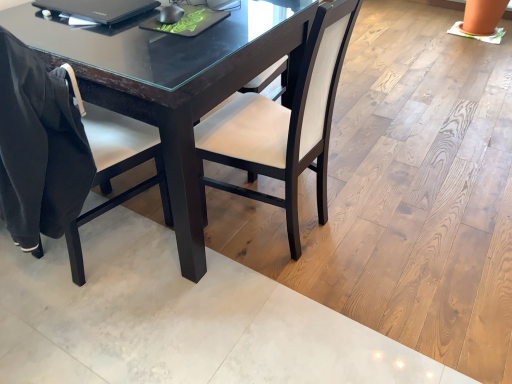
What do you see at coordinates (285, 123) in the screenshot?
I see `satin white chair at center, the 2th chair viewed from the left` at bounding box center [285, 123].

Locate an element on the screen. black matte chair at left, the 2th chair in the right-to-left sequence is located at coordinates (61, 153).

What's the angular difference between satin white chair at center, which is the first chair from right to left, and black matte chair at left, the 2th chair in the right-to-left sequence,'s facing directions?

There is a 88.6-degree angle between the facing directions of satin white chair at center, which is the first chair from right to left, and black matte chair at left, the 2th chair in the right-to-left sequence.

Considering the positions of objects satin white chair at center, the 2th chair viewed from the left, and black matte chair at left, placed as the first chair when sorted from left to right, in the image provided, who is more to the right, satin white chair at center, the 2th chair viewed from the left, or black matte chair at left, placed as the first chair when sorted from left to right,?

satin white chair at center, the 2th chair viewed from the left, is more to the right.

Would you say satin white chair at center, which is the first chair from right to left, is a long distance from black matte chair at left, placed as the first chair when sorted from left to right?

They are positioned close to each other.

Looking at this image, from the image's perspective, which object appears higher, satin white chair at center, the 2th chair viewed from the left, or black matte chair at left, the 2th chair in the right-to-left sequence?

satin white chair at center, the 2th chair viewed from the left.

Is there a large distance between black matte chair at left, the 2th chair in the right-to-left sequence, and satin white chair at center, which is the first chair from right to left?

No, black matte chair at left, the 2th chair in the right-to-left sequence, is in close proximity to satin white chair at center, which is the first chair from right to left.

What are the coordinates of `chair that is in front of the satin white chair at center, the 2th chair viewed from the left` in the screenshot? It's located at (x=61, y=153).

In the image, is black matte chair at left, the 2th chair in the right-to-left sequence, positioned in front of or behind satin white chair at center, which is the first chair from right to left?

Visually, black matte chair at left, the 2th chair in the right-to-left sequence, is located in front of satin white chair at center, which is the first chair from right to left.

Which of these two, black matte chair at left, placed as the first chair when sorted from left to right, or satin white chair at center, which is the first chair from right to left, is wider?

Wider between the two is black matte chair at left, placed as the first chair when sorted from left to right.

Is point (84, 16) positioned in front of point (42, 170)?

That is False.

Does black glossy laptop at upper left come in front of black matte chair at left, the 2th chair in the right-to-left sequence?

No.

In the scene shown: Considering the relative sizes of black glossy laptop at upper left and black matte chair at left, the 2th chair in the right-to-left sequence, in the image provided, is black glossy laptop at upper left smaller than black matte chair at left, the 2th chair in the right-to-left sequence,?

Yes.

Which of these two, satin white chair at center, the 2th chair viewed from the left, or black glossy laptop at upper left, is smaller?

Smaller between the two is black glossy laptop at upper left.

From the image's perspective, is satin white chair at center, which is the first chair from right to left, located beneath black glossy laptop at upper left?

Yes, from the image's perspective, satin white chair at center, which is the first chair from right to left, is below black glossy laptop at upper left.

Is point (272, 108) in front of point (88, 0)?

No, it is behind (88, 0).

From the image's perspective, which is above, black glossy laptop at upper left or satin white chair at center, the 2th chair viewed from the left?

black glossy laptop at upper left is shown above in the image.

Is black glossy laptop at upper left smaller than satin white chair at center, which is the first chair from right to left?

Indeed, black glossy laptop at upper left has a smaller size compared to satin white chair at center, which is the first chair from right to left.

Is the position of black glossy laptop at upper left more distant than that of satin white chair at center, the 2th chair viewed from the left?

Yes, black glossy laptop at upper left is further from the camera.

Which is nearer, (54, 4) or (213, 144)?

The point (54, 4) is closer.

Is black matte chair at left, the 2th chair in the right-to-left sequence, shorter than black glossy laptop at upper left?

In fact, black matte chair at left, the 2th chair in the right-to-left sequence, may be taller than black glossy laptop at upper left.

Consider the image. Which is correct: black matte chair at left, the 2th chair in the right-to-left sequence, is inside black glossy laptop at upper left, or outside of it?

black matte chair at left, the 2th chair in the right-to-left sequence, is not inside black glossy laptop at upper left, it's outside.

Which chair is the 2nd one when counting from the front of the black glossy laptop at upper left? Please provide its 2D coordinates.

[(61, 153)]

Where is `chair lying on the right of black matte chair at left, the 2th chair in the right-to-left sequence`? chair lying on the right of black matte chair at left, the 2th chair in the right-to-left sequence is located at coordinates (285, 123).

The height and width of the screenshot is (384, 512). What are the coordinates of `chair above the satin white chair at center, which is the first chair from right to left (from a real-world perspective)` in the screenshot? It's located at (61, 153).

From the image, which object appears to be farther from black matte chair at left, the 2th chair in the right-to-left sequence, black glossy laptop at upper left or satin white chair at center, the 2th chair viewed from the left?

black glossy laptop at upper left is further to black matte chair at left, the 2th chair in the right-to-left sequence.

Considering their positions, is black matte chair at left, the 2th chair in the right-to-left sequence, positioned further to satin white chair at center, the 2th chair viewed from the left, than black glossy laptop at upper left?

black glossy laptop at upper left is positioned further to the anchor satin white chair at center, the 2th chair viewed from the left.

Which object lies further to the anchor point satin white chair at center, which is the first chair from right to left, black glossy laptop at upper left or black matte chair at left, the 2th chair in the right-to-left sequence?

black glossy laptop at upper left.

Estimate the real-world distances between objects in this image. Which object is closer to black glossy laptop at upper left, black matte chair at left, the 2th chair in the right-to-left sequence, or satin white chair at center, which is the first chair from right to left?

black matte chair at left, the 2th chair in the right-to-left sequence, is positioned closer to the anchor black glossy laptop at upper left.

Which object lies nearer to the anchor point black glossy laptop at upper left, satin white chair at center, the 2th chair viewed from the left, or black matte chair at left, the 2th chair in the right-to-left sequence?

Among the two, black matte chair at left, the 2th chair in the right-to-left sequence, is located nearer to black glossy laptop at upper left.

Which object lies further to the anchor point black matte chair at left, the 2th chair in the right-to-left sequence, satin white chair at center, the 2th chair viewed from the left, or black glossy laptop at upper left?

The object further to black matte chair at left, the 2th chair in the right-to-left sequence, is black glossy laptop at upper left.

You are a GUI agent. You are given a task and a screenshot of the screen. Output one action in this format:
    pyautogui.click(x=<x>, y=<y>)
    Task: Click on the laptop between black matte chair at left, placed as the first chair when sorted from left to right, and satin white chair at center, which is the first chair from right to left
    Image resolution: width=512 pixels, height=384 pixels.
    Given the screenshot: What is the action you would take?
    pyautogui.click(x=98, y=9)